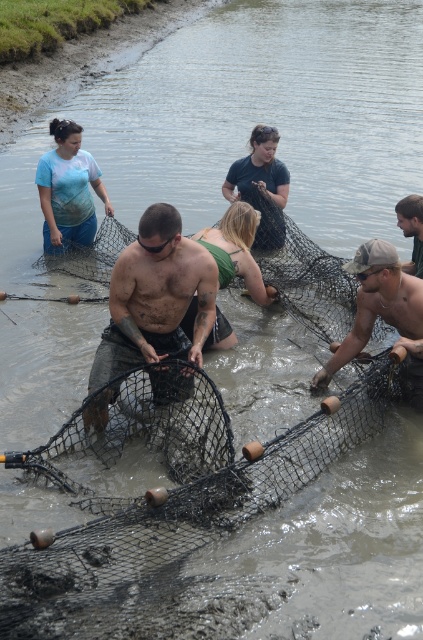
You are a fisherman trying to decide which net to use. Both the dirty black net at center and the rusty metal net at center are available. Based on their sizes, which one could potentially cover a larger area when spread out?

The dirty black net at center might be wider than rusty metal net at center, so it could potentially cover a larger area when spread out.

You are a photographer trying to capture the scene of the fishing activity. You notice the dirty black net at center and the dark brown leather jacket at upper right. Which object should you focus on if you want to photograph the larger item in the scene?

The dirty black net at center has a larger size compared to the dark brown leather jacket at upper right, so you should focus on the dirty black net at center to photograph the larger item.